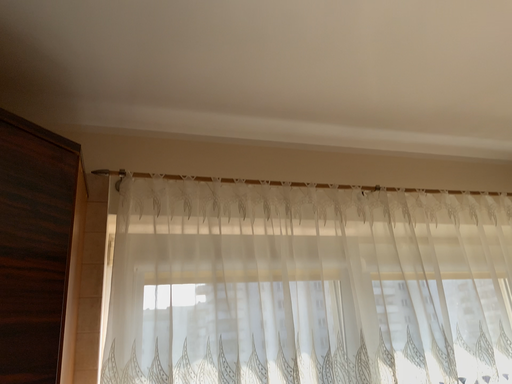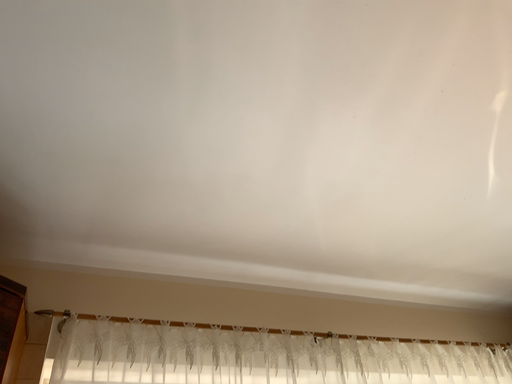
Question: How did the camera likely rotate when shooting the video?

Choices:
 (A) rotated upward
 (B) rotated downward

Answer: (A)